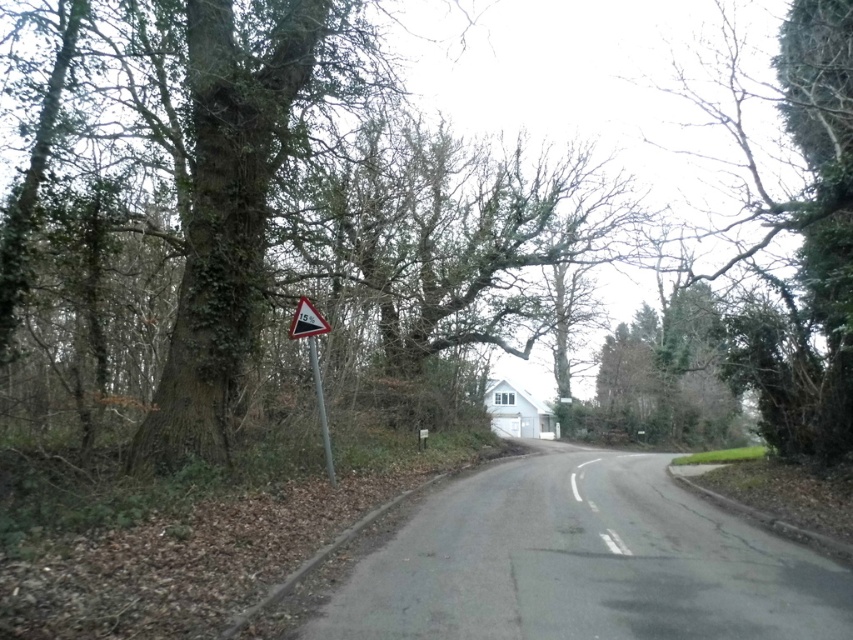
You are driving a car and see two points on the road ahead. The first point is at position point (323,429), and the second point is at position point (299,300). Which point is closer to your current position?

Point (299,300) is closer to your current position because it is behind point (323,429), which is further ahead.

You are standing at the point marked by the coordinates point (793, 230). Looking towards the road, what do you see in the direction of the road?

The point (793, 230) marks the green leafy tree at upper right, so looking towards the road from there, you would see the road curving gently to the right with the large tree on the left side and the speed limit sign nearby.